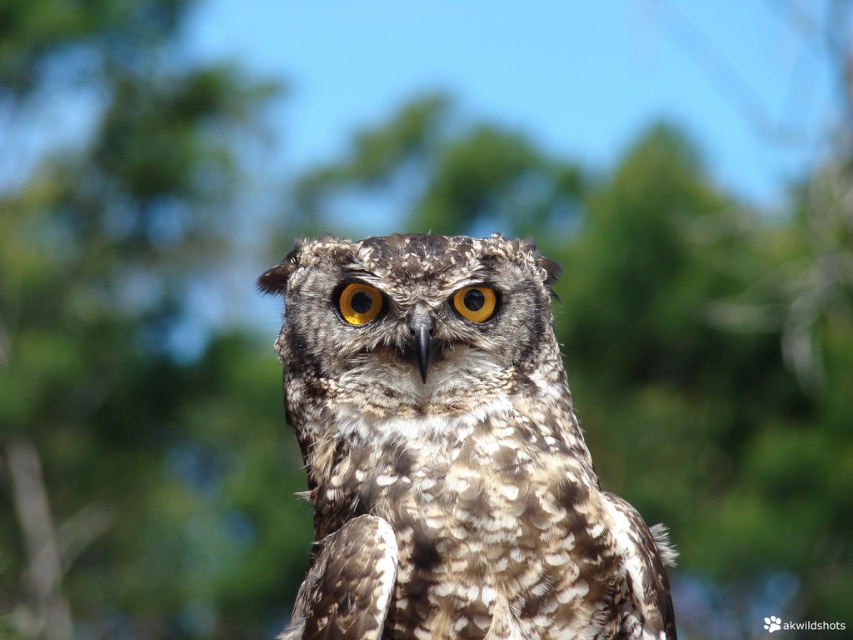
You are an ornithologist examining the owl in the image. You notice a point marked at coordinates (358, 301). Based on the scene description, what significant feature does this point likely indicate?

→ The point at coordinates (358, 301) marks the golden matte eye at center, which is the owl s strikingly bright yellow eye described in the scene.